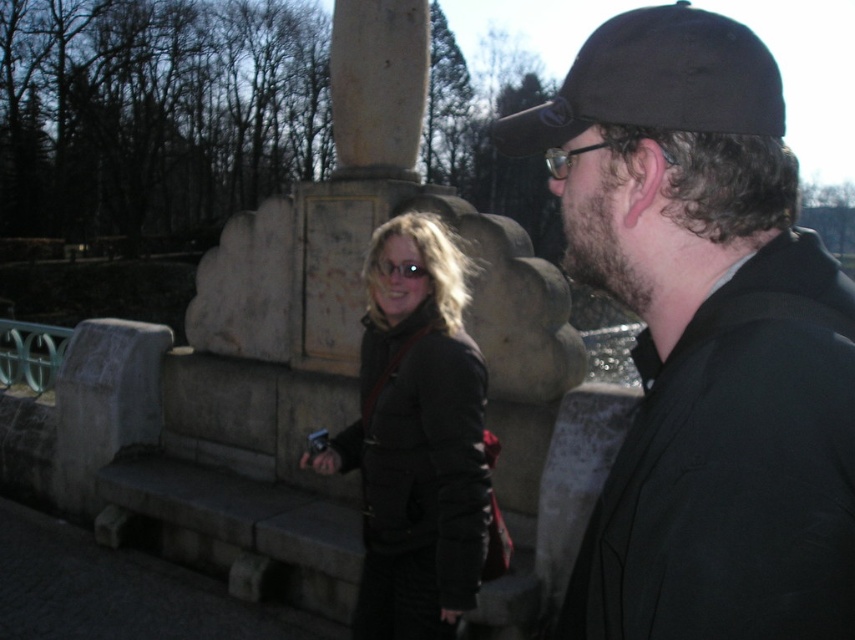
You are an observer looking at the scene. You notice the black matte cap at upper right and the matte black jacket at center. Which object appears larger in the image?

The matte black jacket at center appears larger than the black matte cap at upper right.

You are a photographer trying to capture a clear shot of the matte black jacket at center. Your camera is 7.96 feet away from the jacket. Is this distance within the camera lens minimum focusing distance of 8 feet?

The matte black jacket at center and camera are 7.96 feet apart, so yes, the distance is within the camera lens minimum focusing distance of 8 feet.

Looking at this image, you are a photographer trying to capture both the black matte cap at upper right and the black fabric baseball cap at upper right in a single shot. However, you notice that one of them is partially obscured. Which cap is blocking the view of the other?

The black matte cap at upper right is in front of the black fabric baseball cap at upper right, so it is blocking the view of the latter.